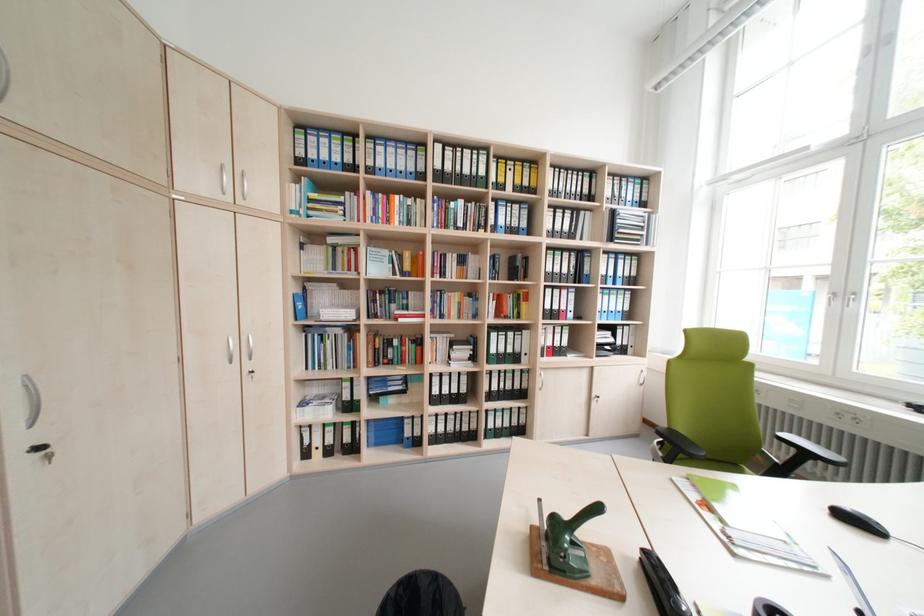
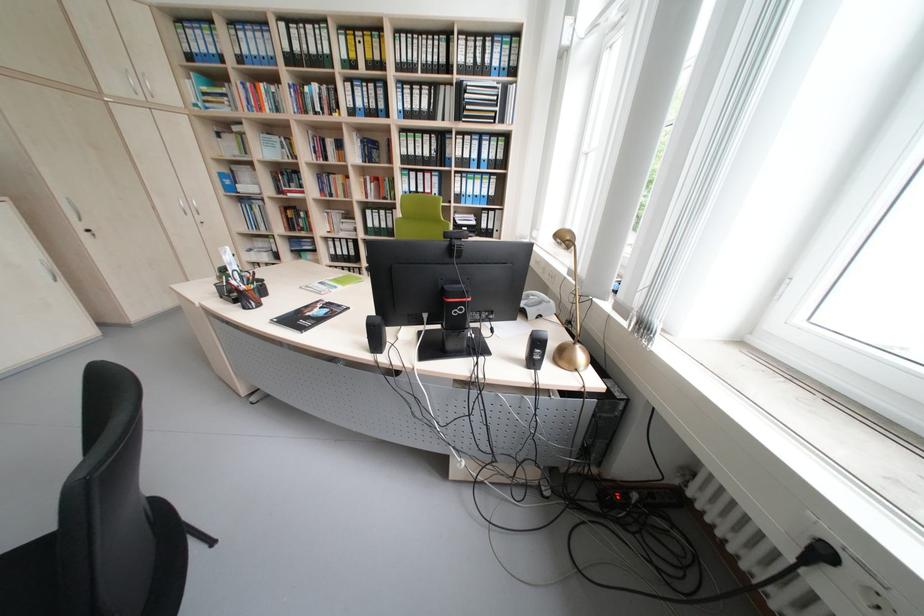
The point at (617, 349) is marked in the first image. Where is the corresponding point in the second image?

(476, 230)